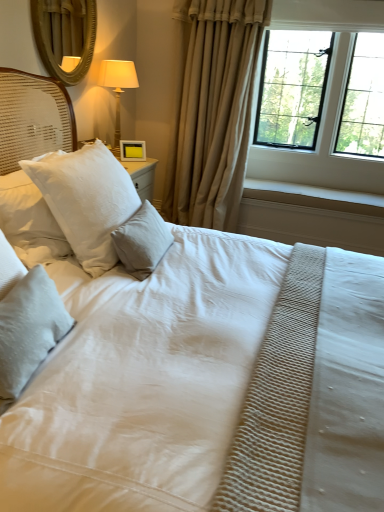
Measure the distance between point (x=41, y=303) and camera.

The depth of point (x=41, y=303) is 1.32 meters.

Describe the element at coordinates (29, 329) in the screenshot. The width and height of the screenshot is (384, 512). I see `white textured pillow at lower left, which is the first pillow from front to back` at that location.

Locate an element on the screen. This screenshot has height=512, width=384. matte gold lamp at upper left is located at coordinates (118, 83).

What do you see at coordinates (118, 83) in the screenshot?
I see `matte gold lamp at upper left` at bounding box center [118, 83].

What do you see at coordinates (65, 35) in the screenshot? This screenshot has height=512, width=384. I see `gold textured mirror at upper left` at bounding box center [65, 35].

Identify the location of yellow matte picture frame at upper center. The image size is (384, 512). pos(132,150).

Is white textured pillow at center, the 1th pillow from the back, inside gold textured mirror at upper left?

No, white textured pillow at center, the 1th pillow from the back, is not surrounded by gold textured mirror at upper left.

Who is more distant, gold textured mirror at upper left or white textured pillow at center, the 1th pillow from the back?

Positioned behind is gold textured mirror at upper left.

Is matte gold lamp at upper left closer to the viewer compared to white textured pillow at center, placed as the 3th pillow when sorted from front to back?

That is False.

Which is behind, point (105, 81) or point (127, 241)?

The point (105, 81) is behind.

Does matte gold lamp at upper left contain white textured pillow at center, the 1th pillow from the back?

No, white textured pillow at center, the 1th pillow from the back, is not surrounded by matte gold lamp at upper left.

Can you confirm if yellow matte picture frame at upper center is shorter than gold textured mirror at upper left?

Yes.

Which of these two, yellow matte picture frame at upper center or gold textured mirror at upper left, is bigger?

gold textured mirror at upper left is bigger.

Is gold textured mirror at upper left surrounded by yellow matte picture frame at upper center?

No, gold textured mirror at upper left is not surrounded by yellow matte picture frame at upper center.

Where is `bedside lamp on the left of yellow matte picture frame at upper center`? bedside lamp on the left of yellow matte picture frame at upper center is located at coordinates (118, 83).

From the image's perspective, is yellow matte picture frame at upper center above or below matte gold lamp at upper left?

yellow matte picture frame at upper center is below matte gold lamp at upper left.

How different are the orientations of yellow matte picture frame at upper center and matte gold lamp at upper left in degrees?

yellow matte picture frame at upper center and matte gold lamp at upper left are facing 46.8 degrees away from each other.

Between yellow matte picture frame at upper center and matte gold lamp at upper left, which one has smaller size?

yellow matte picture frame at upper center.

Which is nearer, (182, 9) or (133, 71)?

Point (182, 9) is positioned farther from the camera compared to point (133, 71).

From a real-world perspective, which object stands above the other?

matte gold lamp at upper left, from a real-world perspective.

From the image's perspective, which one is positioned higher, beige fabric curtain at center or matte gold lamp at upper left?

matte gold lamp at upper left, from the image's perspective.

Based on their positions, is beige fabric curtain at center located to the left or right of matte gold lamp at upper left?

In the image, beige fabric curtain at center appears on the right side of matte gold lamp at upper left.

Does white textured pillow at center, placed as the 3th pillow when sorted from front to back, lie in front of white textured pillow at upper left, arranged as the 2th pillow when viewed from the back?

That is False.

From the image's perspective, is white textured pillow at center, the 1th pillow from the back, above or below white textured pillow at upper left, placed as the second pillow when sorted from front to back?

From the image's perspective, white textured pillow at center, the 1th pillow from the back, appears below white textured pillow at upper left, placed as the second pillow when sorted from front to back.

How many degrees apart are the facing directions of white textured pillow at center, the 1th pillow from the back, and white textured pillow at upper left, placed as the second pillow when sorted from front to back?

The angular difference between white textured pillow at center, the 1th pillow from the back, and white textured pillow at upper left, placed as the second pillow when sorted from front to back, is 2.02 degrees.

In the scene shown: Does white textured pillow at center, placed as the 3th pillow when sorted from front to back, appear on the right side of white textured pillow at upper left, placed as the second pillow when sorted from front to back?

Yes.

Who is taller, gold textured mirror at upper left or yellow matte picture frame at upper center?

gold textured mirror at upper left is taller.

In the image, is gold textured mirror at upper left on the left side or the right side of yellow matte picture frame at upper center?

gold textured mirror at upper left is to the left of yellow matte picture frame at upper center.

Considering the positions of objects gold textured mirror at upper left and yellow matte picture frame at upper center in the image provided, who is in front, gold textured mirror at upper left or yellow matte picture frame at upper center?

gold textured mirror at upper left is more forward.

Image resolution: width=384 pixels, height=512 pixels. What are the coordinates of `mirror above the white textured pillow at center, the 1th pillow from the back (from the image's perspective)` in the screenshot? It's located at (65, 35).

The width and height of the screenshot is (384, 512). I want to click on bedside lamp that is above the white textured pillow at center, the 1th pillow from the back (from a real-world perspective), so click(x=118, y=83).

Looking at the image, which one is located further to white textured pillow at lower left, which is the first pillow from front to back, white textured pillow at upper left, arranged as the 2th pillow when viewed from the back, or gold textured mirror at upper left?

Among the two, gold textured mirror at upper left is located further to white textured pillow at lower left, which is the first pillow from front to back.

Estimate the real-world distances between objects in this image. Which object is closer to beige fabric curtain at center, yellow matte picture frame at upper center or white textured pillow at upper left, placed as the second pillow when sorted from front to back?

yellow matte picture frame at upper center.

From the image, which object appears to be farther from white textured pillow at upper left, placed as the second pillow when sorted from front to back, beige fabric curtain at center or gold textured mirror at upper left?

The object further to white textured pillow at upper left, placed as the second pillow when sorted from front to back, is gold textured mirror at upper left.

From the image, which object appears to be nearer to matte gold lamp at upper left, white textured pillow at center, placed as the 3th pillow when sorted from front to back, or white textured pillow at lower left, which is the third pillow in back-to-front order?

white textured pillow at center, placed as the 3th pillow when sorted from front to back, is positioned closer to the anchor matte gold lamp at upper left.

Looking at the image, which one is located further to white textured pillow at upper left, arranged as the 2th pillow when viewed from the back, black metal window at upper right or yellow matte picture frame at upper center?

Based on the image, black metal window at upper right appears to be further to white textured pillow at upper left, arranged as the 2th pillow when viewed from the back.

From the image, which object appears to be nearer to yellow matte picture frame at upper center, white textured pillow at lower left, which is the third pillow in back-to-front order, or white textured pillow at upper left, arranged as the 2th pillow when viewed from the back?

white textured pillow at upper left, arranged as the 2th pillow when viewed from the back, lies closer to yellow matte picture frame at upper center than the other object.

From the image, which object appears to be nearer to white textured pillow at lower left, which is the third pillow in back-to-front order, beige fabric curtain at center or matte gold lamp at upper left?

matte gold lamp at upper left is positioned closer to the anchor white textured pillow at lower left, which is the third pillow in back-to-front order.

Considering their positions, is gold textured mirror at upper left positioned further to white textured pillow at upper left, placed as the second pillow when sorted from front to back, than matte gold lamp at upper left?

gold textured mirror at upper left is further to white textured pillow at upper left, placed as the second pillow when sorted from front to back.

At what (x,y) coordinates should I click in order to perform the action: click on mirror between white textured pillow at upper left, arranged as the 2th pillow when viewed from the back, and matte gold lamp at upper left in the front-back direction. Please return your answer as a coordinate pair (x, y). The width and height of the screenshot is (384, 512). Looking at the image, I should click on (65, 35).

What are the coordinates of `picture frame situated between gold textured mirror at upper left and black metal window at upper right from left to right` in the screenshot? It's located at (132, 150).

Where is `bedside lamp between gold textured mirror at upper left and white textured pillow at center, placed as the 3th pillow when sorted from front to back, in the vertical direction`? The image size is (384, 512). bedside lamp between gold textured mirror at upper left and white textured pillow at center, placed as the 3th pillow when sorted from front to back, in the vertical direction is located at coordinates (118, 83).

You are a GUI agent. You are given a task and a screenshot of the screen. Output one action in this format:
    pyautogui.click(x=<x>, y=<y>)
    Task: Click on the curtain between white textured pillow at lower left, which is the third pillow in back-to-front order, and yellow matte picture frame at upper center in the front-back direction
    Image resolution: width=384 pixels, height=512 pixels.
    Given the screenshot: What is the action you would take?
    pyautogui.click(x=212, y=109)